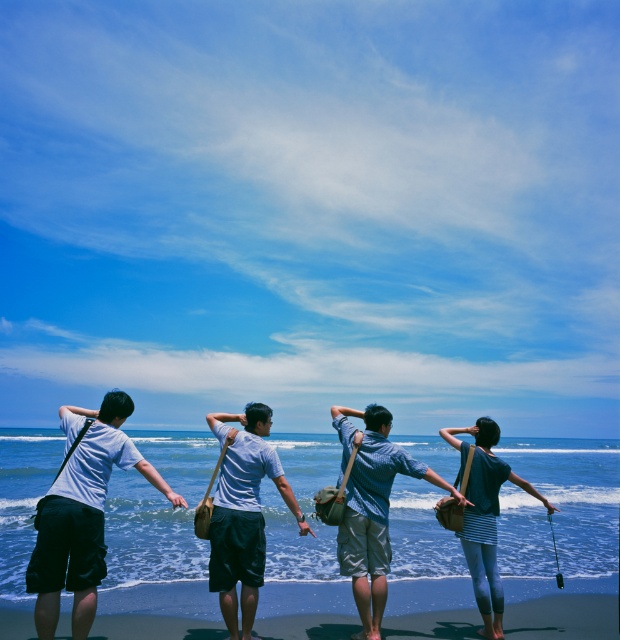
Can you confirm if white matte t-shirt at center is taller than smooth skin hand at center?

Yes, white matte t-shirt at center is taller than smooth skin hand at center.

Which of these two, white matte t-shirt at center or smooth skin hand at center, stands shorter?

smooth skin hand at center

Between point (215, 499) and point (472, 433), which one is positioned in front?

Point (215, 499)

Where is `white matte t-shirt at center`? This screenshot has width=620, height=640. white matte t-shirt at center is located at coordinates (244, 518).

Is smooth sand at lower center taller than blue striped shirt at center?

No.

Can you confirm if smooth sand at lower center is positioned below blue striped shirt at center?

Yes.

Is point (275, 584) closer to viewer compared to point (360, 492)?

No, it is behind (360, 492).

Where is `smooth sand at lower center`? smooth sand at lower center is located at coordinates (157, 611).

Does smooth sand at lower center appear on the left side of white matte t-shirt at left?

Yes, smooth sand at lower center is to the left of white matte t-shirt at left.

Describe the element at coordinates (157, 611) in the screenshot. I see `smooth sand at lower center` at that location.

Where is `smooth sand at lower center`? The height and width of the screenshot is (640, 620). smooth sand at lower center is located at coordinates (157, 611).